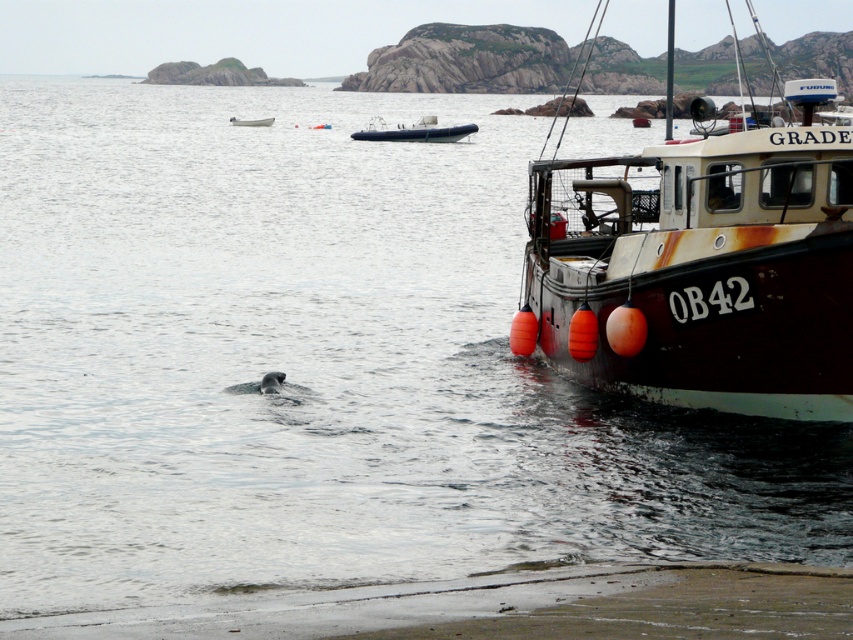
What do you see at coordinates (703, 269) in the screenshot?
I see `rusty metal boat at right` at bounding box center [703, 269].

Based on the photo, which of these two, rusty metal boat at right or sandy beach at lower left, stands shorter?

Standing shorter between the two is sandy beach at lower left.

Does point (798, 97) come farther from viewer compared to point (323, 589)?

Yes, it is.

You are a GUI agent. You are given a task and a screenshot of the screen. Output one action in this format:
    pyautogui.click(x=<x>, y=<y>)
    Task: Click on the rusty metal boat at right
    
    Given the screenshot: What is the action you would take?
    703,269

Based on the photo, is blue rubber dinghy at upper center to the left of white plastic dinghy at upper left from the viewer's perspective?

In fact, blue rubber dinghy at upper center is to the right of white plastic dinghy at upper left.

Is blue rubber dinghy at upper center above white plastic dinghy at upper left?

Incorrect, blue rubber dinghy at upper center is not positioned above white plastic dinghy at upper left.

Is point (430, 134) positioned after point (241, 122)?

No, (430, 134) is in front of (241, 122).

You are a GUI agent. You are given a task and a screenshot of the screen. Output one action in this format:
    pyautogui.click(x=<x>, y=<y>)
    Task: Click on the blue rubber dinghy at upper center
    This screenshot has height=640, width=853.
    Given the screenshot: What is the action you would take?
    pyautogui.click(x=415, y=131)

The height and width of the screenshot is (640, 853). Identify the location of sandy beach at lower left. (508, 605).

Between sandy beach at lower left and white plastic dinghy at upper left, which one has more height?

white plastic dinghy at upper left is taller.

Measure the distance between point (573, 636) and camera.

8.69 meters

Where is `sandy beach at lower left`? The height and width of the screenshot is (640, 853). sandy beach at lower left is located at coordinates pyautogui.click(x=508, y=605).